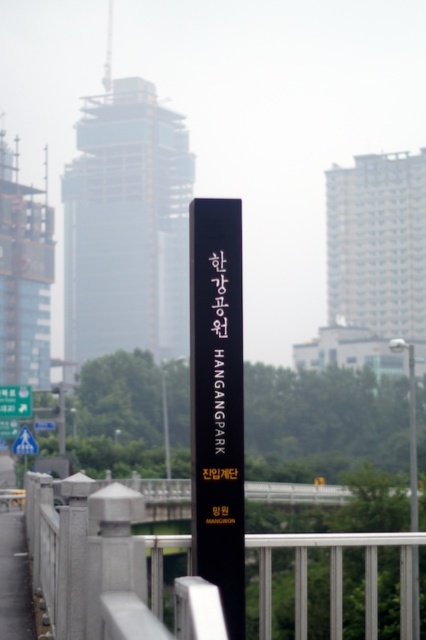
Question: Can you confirm if smooth stone railing at center is positioned to the left of blue plastic traffic sign at upper left?

Choices:
 (A) no
 (B) yes

Answer: (A)

Question: Which of the following is the farthest from the observer?

Choices:
 (A) blue plastic traffic sign at upper left
 (B) smooth stone railing at center

Answer: (A)

Question: Is smooth stone railing at center wider than blue plastic traffic sign at upper left?

Choices:
 (A) no
 (B) yes

Answer: (B)

Question: Can you confirm if smooth stone railing at center is smaller than blue plastic traffic sign at upper left?

Choices:
 (A) yes
 (B) no

Answer: (B)